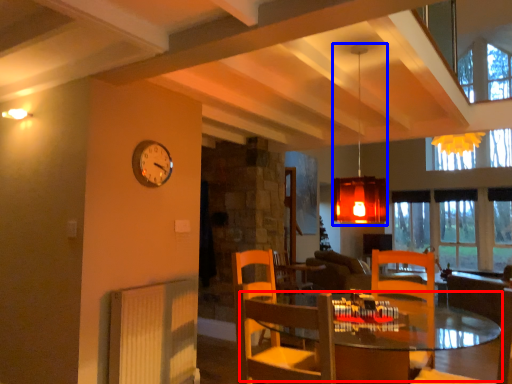
Question: Among these objects, which one is nearest to the camera, table (highlighted by a red box) or lamp (highlighted by a blue box)?

Choices:
 (A) table
 (B) lamp

Answer: (A)